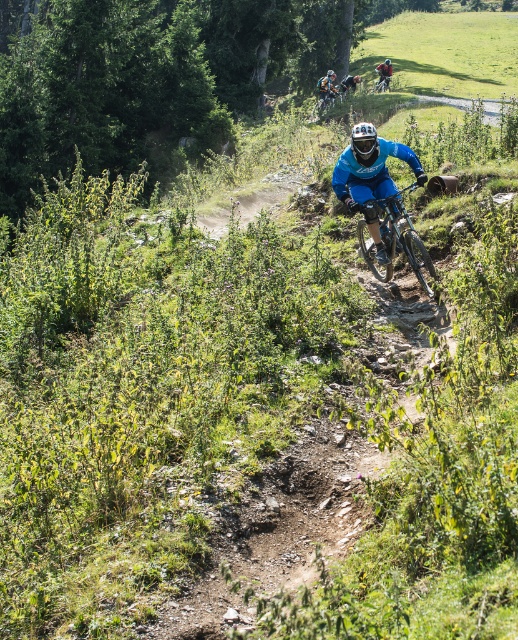
Question: Is blue matte bicycle at center wider than shiny blue frame at center?

Choices:
 (A) no
 (B) yes

Answer: (B)

Question: Which of the following is the farthest from the observer?

Choices:
 (A) (433, 296)
 (B) (380, 67)
 (C) (382, 154)

Answer: (B)

Question: Which object appears farthest from the camera in this image?

Choices:
 (A) blue matte helmet at upper center
 (B) shiny blue frame at center

Answer: (A)

Question: Can you confirm if shiny blue frame at center is positioned to the right of blue matte helmet at upper center?

Choices:
 (A) no
 (B) yes

Answer: (A)

Question: Which of the following is the closest to the observer?

Choices:
 (A) shiny blue frame at center
 (B) blue matte bicycle at center
 (C) blue matte helmet at upper center

Answer: (A)

Question: Can you confirm if blue matte bicycle at center is smaller than shiny blue frame at center?

Choices:
 (A) yes
 (B) no

Answer: (A)